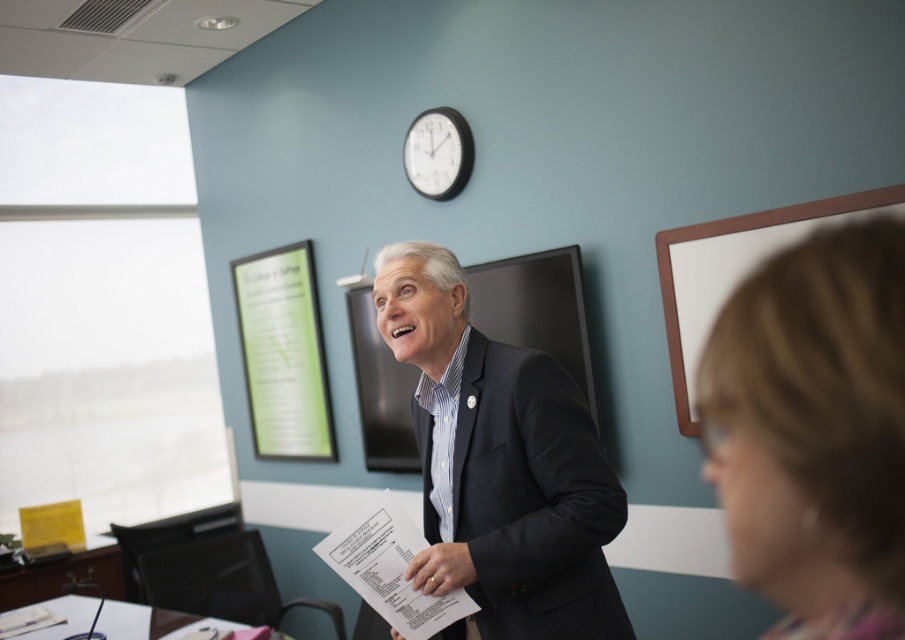
Question: Which point appears farthest from the camera in this image?

Choices:
 (A) (599, 506)
 (B) (886, 570)

Answer: (A)

Question: Does dark gray suit at center have a greater width compared to white matte board at upper right?

Choices:
 (A) no
 (B) yes

Answer: (B)

Question: Which point is farther from the camera taking this photo?

Choices:
 (A) (463, 156)
 (B) (561, 604)

Answer: (A)

Question: From the image, what is the correct spatial relationship of dark gray suit at center in relation to white glossy clock at upper center?

Choices:
 (A) left
 (B) right

Answer: (B)

Question: Is dark gray suit at center bigger than white matte board at upper right?

Choices:
 (A) yes
 (B) no

Answer: (B)

Question: Among these objects, which one is nearest to the camera?

Choices:
 (A) white matte board at upper right
 (B) dark gray suit at center
 (C) blonde hair at lower right

Answer: (C)